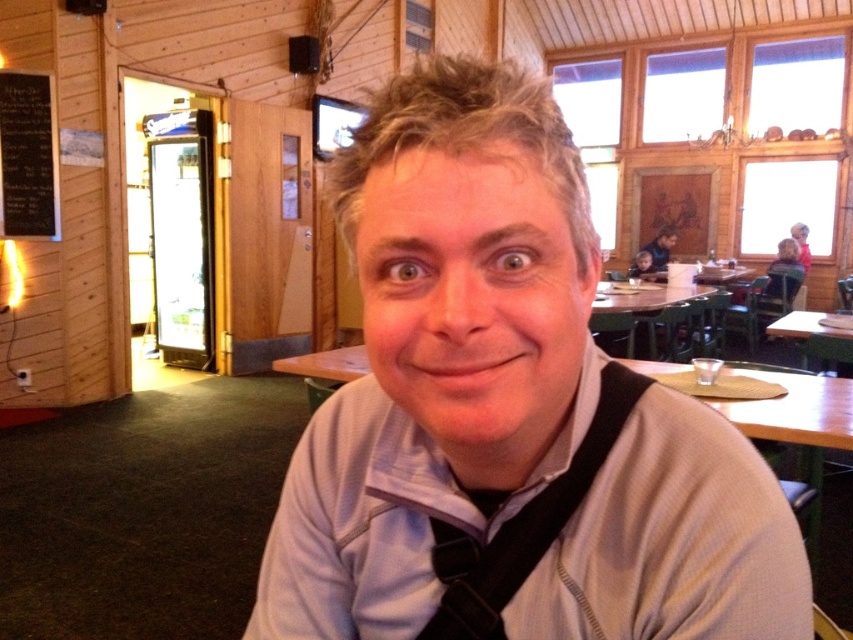
Based on the scene description, where is the white textured dress shirt at center located in the image?

The white textured dress shirt at center is located at the 2D coordinates point (672, 540) in the image.

Looking at this image, you are a photographer setting up for an event. You need to place a 1.2 meter tall tripod between the black fabric suspenders at center and the green matte table at right. Can the tripod fit vertically between them?

The black fabric suspenders at center is shorter than the green matte table at right. Since the tripod is 1.2 meters tall, it can only fit if the space between them is at least that height. However, the suspenders are shorter than the table, but their exact height isn